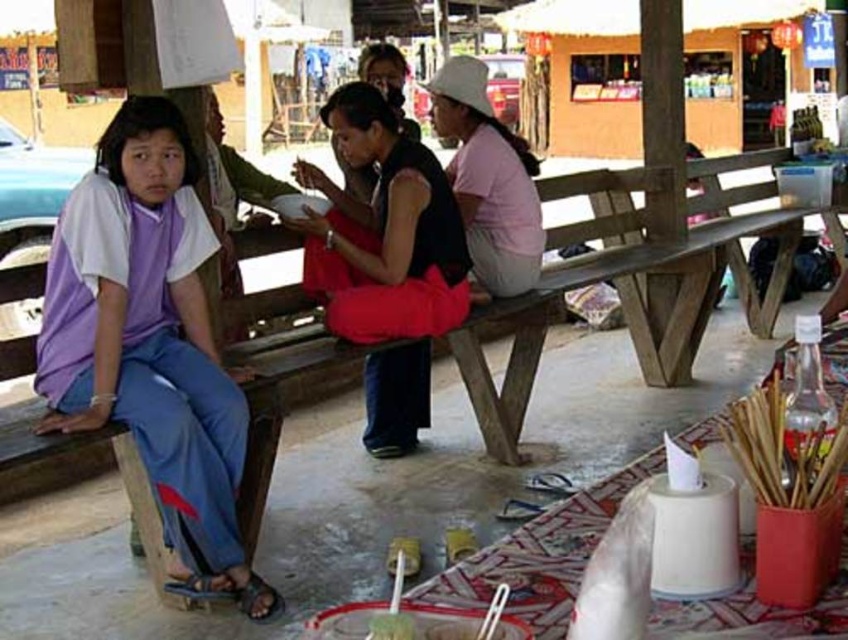
Who is positioned more to the right, purple cotton shirt at left or black matte dress at center?

black matte dress at center

Is purple cotton shirt at left to the right of black matte dress at center from the viewer's perspective?

In fact, purple cotton shirt at left is to the left of black matte dress at center.

Between point (204, 566) and point (421, 230), which one is positioned behind?

Positioned behind is point (421, 230).

In order to click on purple cotton shirt at left in this screenshot , I will do `click(149, 340)`.

Is purple cotton shirt at left closer to the viewer compared to pink cotton shirt at center?

Yes, purple cotton shirt at left is in front of pink cotton shirt at center.

Can you confirm if purple cotton shirt at left is positioned to the left of pink cotton shirt at center?

Indeed, purple cotton shirt at left is positioned on the left side of pink cotton shirt at center.

You are a GUI agent. You are given a task and a screenshot of the screen. Output one action in this format:
    pyautogui.click(x=<x>, y=<y>)
    Task: Click on the purple cotton shirt at left
    The width and height of the screenshot is (848, 640).
    Given the screenshot: What is the action you would take?
    pyautogui.click(x=149, y=340)

Is point (327, 314) positioned after point (375, 67)?

That is False.

You are a GUI agent. You are given a task and a screenshot of the screen. Output one action in this format:
    pyautogui.click(x=<x>, y=<y>)
    Task: Click on the black matte dress at center
    
    Given the screenshot: What is the action you would take?
    pyautogui.click(x=383, y=230)

The image size is (848, 640). What are the coordinates of `black matte dress at center` in the screenshot? It's located at (383, 230).